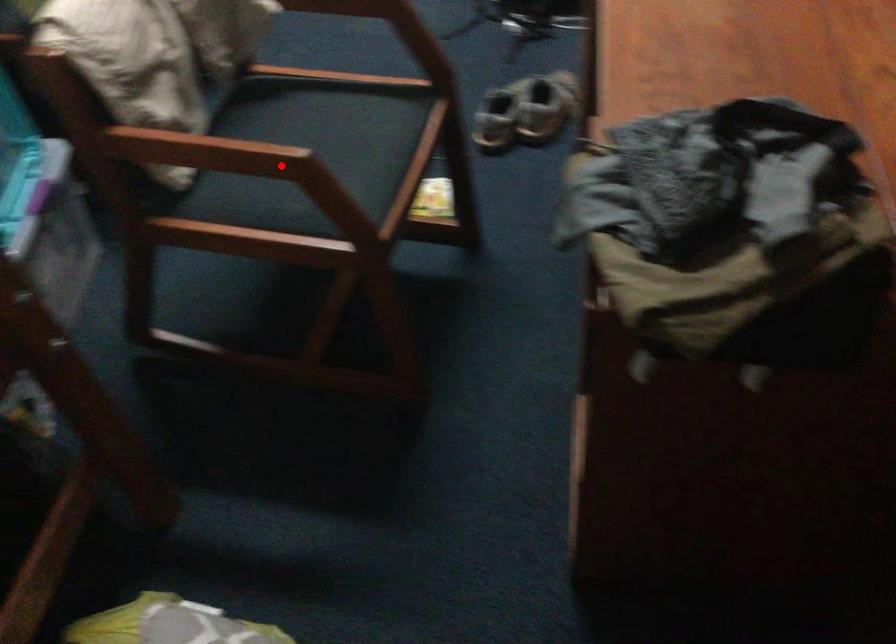
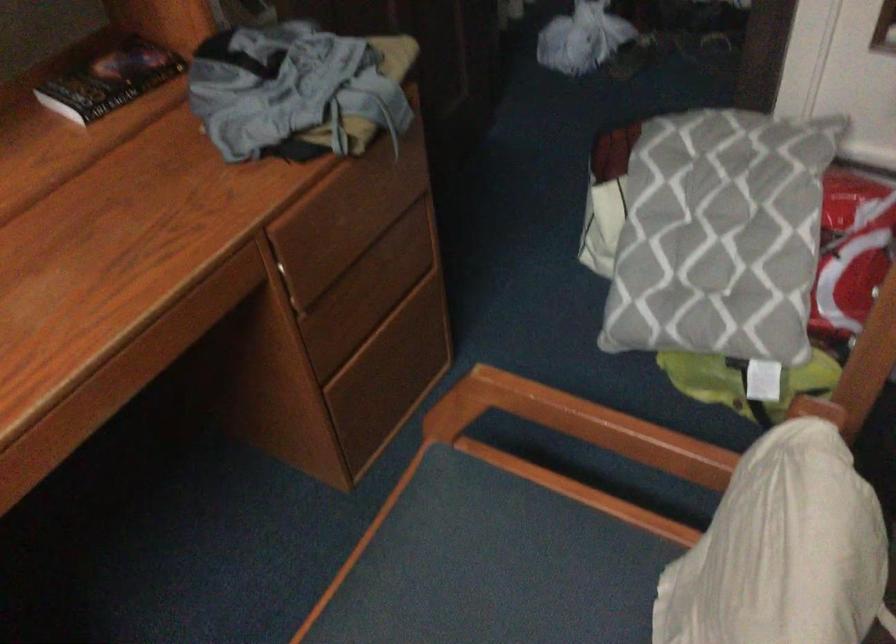
Question: I am providing you with two images of the same scene from different viewpoints. Image1 has a red point marked. In image2, the corresponding 3D location appears at what relative position? Reply with the corresponding letter.

Choices:
 (A) Closer
 (B) Farther

Answer: (A)